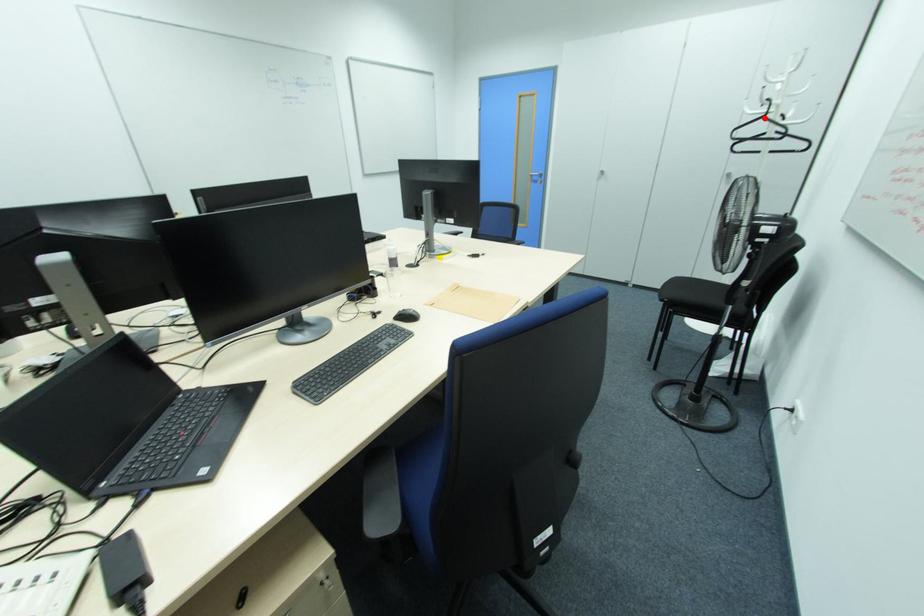
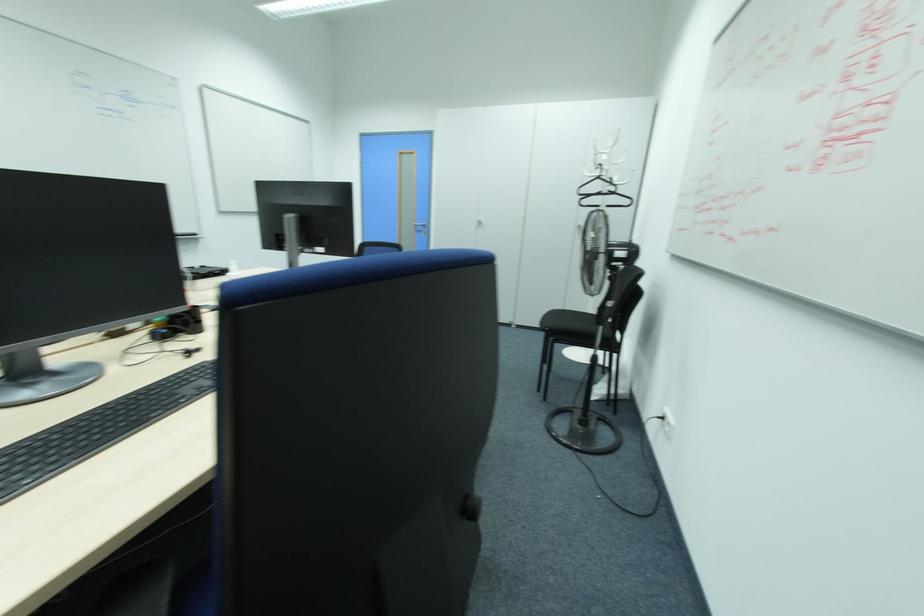
In the second image, find the point that corresponds to the highlighted location in the first image.

(599, 177)